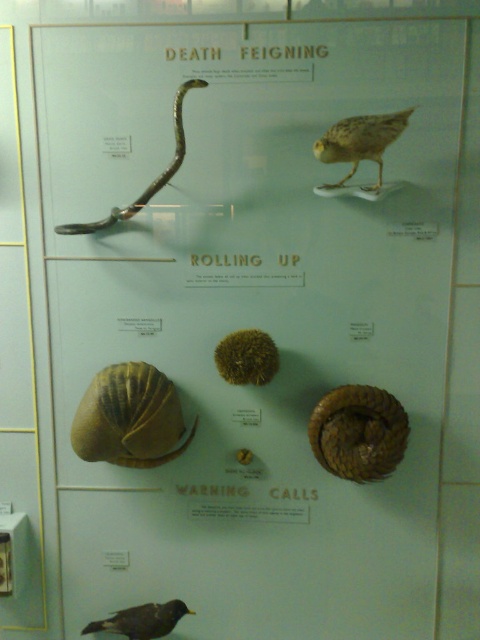
I want to click on brown scaly snail at center, so click(359, 433).

At what (x,y) coordinates should I click in order to perform the action: click on brown scaly snail at center. Please return your answer as a coordinate pair (x, y). Looking at the image, I should click on (359, 433).

I want to click on brown scaly snail at center, so click(359, 433).

Which is above, yellow matte snail at lower left or black feathered bird at lower left?

yellow matte snail at lower left is above.

Does point (129, 397) come in front of point (93, 624)?

Yes, it is in front of point (93, 624).

Is point (163, 380) behind point (129, 625)?

No, it is not.

This screenshot has height=640, width=480. In order to click on yellow matte snail at lower left in this screenshot , I will do `click(130, 417)`.

Can you confirm if speckled feathered bird at upper center is smaller than shiny silver snail at upper left?

Correct, speckled feathered bird at upper center occupies less space than shiny silver snail at upper left.

At what (x,y) coordinates should I click in order to perform the action: click on speckled feathered bird at upper center. Please return your answer as a coordinate pair (x, y). Looking at the image, I should click on (360, 141).

The image size is (480, 640). Find the location of `speckled feathered bird at upper center`. speckled feathered bird at upper center is located at coordinates (360, 141).